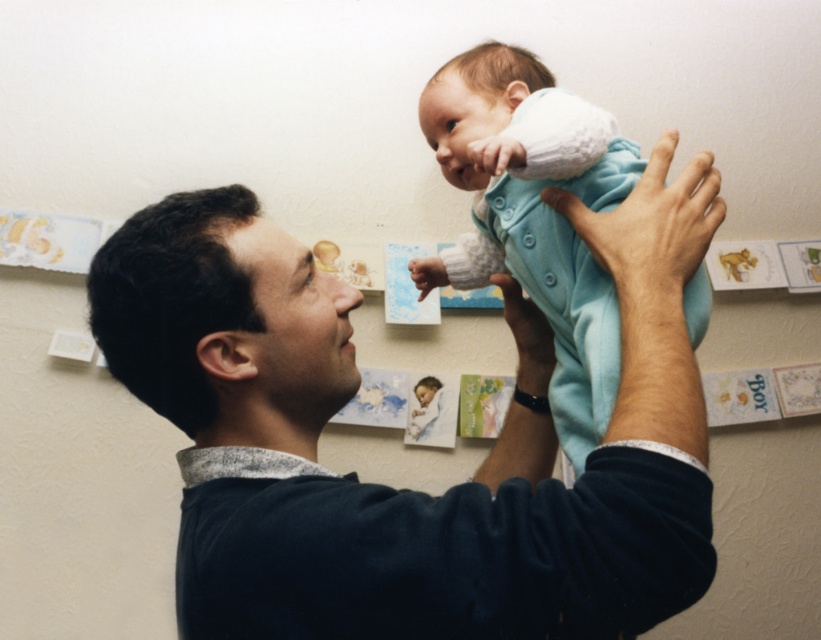
You are a photographer trying to capture the baby in the light blue fleece onesie at upper center and the adult in the dark blue sweater at upper center. Which one is positioned higher in the frame?

The light blue fleece onesie at upper center is positioned higher than the dark blue sweater at upper center.

You are a photographer trying to capture a closeup of the dark blue sweater at upper center and the light blue fleece onesie at upper center. Since both are at upper center, which one will appear larger in the photo?

The dark blue sweater at upper center is closer to the viewer than the light blue fleece onesie at upper center, so it will appear larger in the photo.

You are a fashion designer observing the scene. You need to determine which clothing item, the dark blue sweater at upper center or the light blue fleece onesie at upper center, would require more fabric to produce based on their sizes. Which one would need more fabric?

Result: The light blue fleece onesie at upper center would require more fabric to produce because it is larger in size compared to the dark blue sweater at upper center.